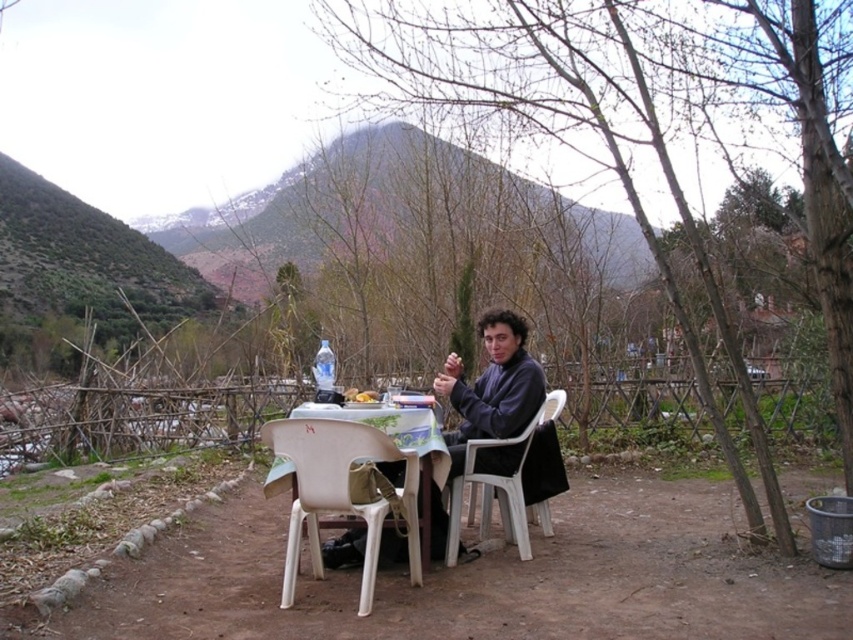
You are standing at the origin point in the garden scene. There is a white plastic chair at lower center. Can you walk directly towards the chair without moving around any obstacles?

The white plastic chair at lower center is located at point (340, 492). Since there are no obstacles mentioned in the scene description, you can walk directly towards the chair without needing to move around anything.